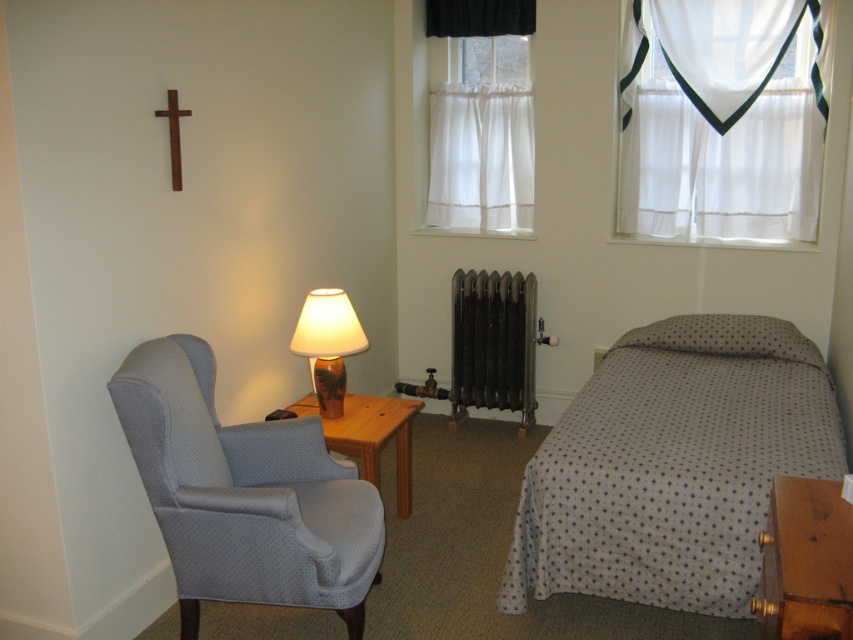
Question: Which of the following is the closest to the observer?

Choices:
 (A) (799, 339)
 (B) (502, 333)
 (C) (486, 24)

Answer: (A)

Question: Which of these objects is positioned closest to the white sheer curtains at upper center?

Choices:
 (A) black fabric curtain at upper center
 (B) wooden side table at center

Answer: (A)

Question: Which is nearer to the white sheer curtains at upper center?

Choices:
 (A) wooden side table at center
 (B) gray dotted pillow at right
 (C) white dotted fabric bed at right
 (D) black fabric curtain at upper center

Answer: (D)

Question: Where is white dotted fabric bed at right located in relation to light blue fabric swivel chair at left in the image?

Choices:
 (A) below
 (B) above

Answer: (B)

Question: Is wooden side table at center below matte ceramic lamp at center?

Choices:
 (A) yes
 (B) no

Answer: (A)

Question: Does light blue fabric swivel chair at left come in front of wooden side table at center?

Choices:
 (A) yes
 (B) no

Answer: (A)